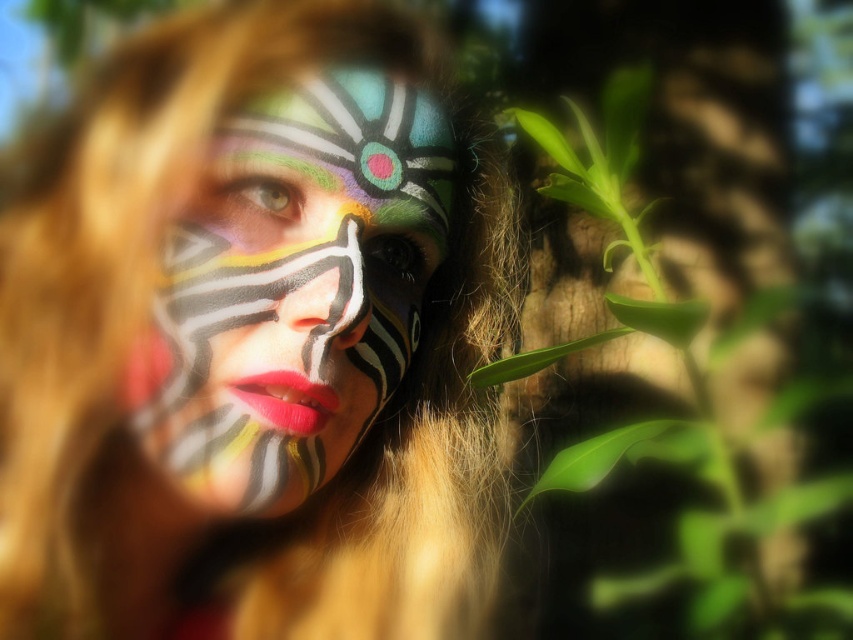
You are a photographer trying to capture the perfect shot of the matte paint face at center. To ensure the subject is centered in the frame, you need to adjust your camera. What are the coordinates you should aim for?

You should aim for the coordinates at point [254,339] to center the matte paint face at center in the frame.